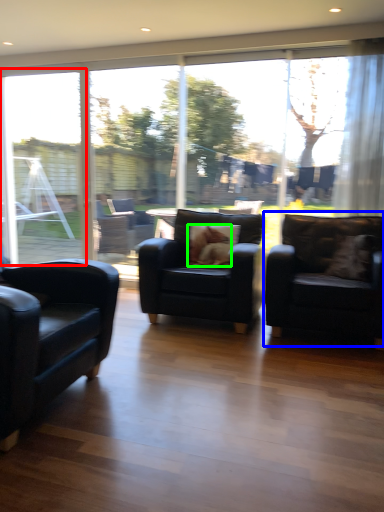
Question: Based on their relative distances, which object is nearer to window frame (highlighted by a red box)? Choose from chair (highlighted by a blue box) and animal (highlighted by a green box).

Choices:
 (A) chair
 (B) animal

Answer: (B)